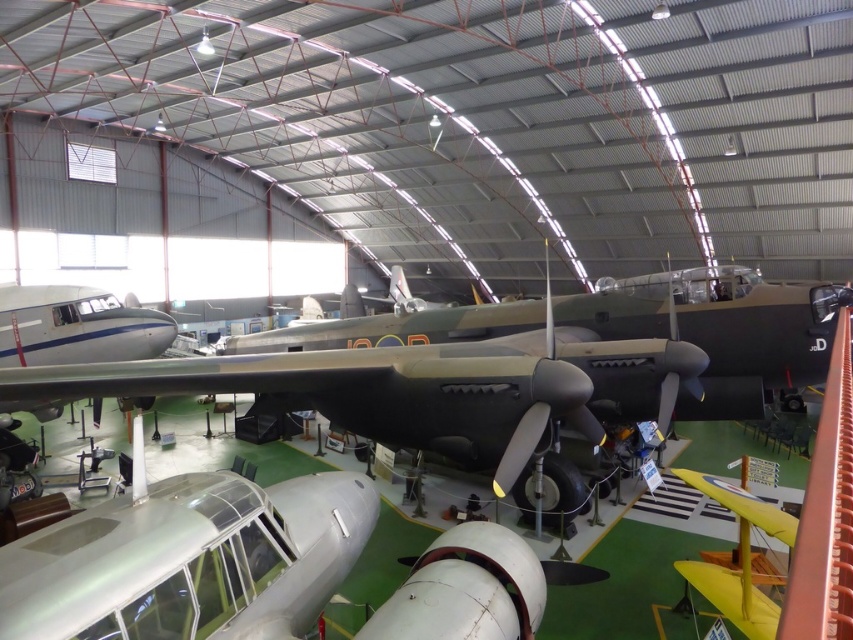
Is point (160, 387) positioned before point (722, 500)?

Yes, point (160, 387) is closer to viewer.

Which of these two, camouflage paint airplane at center or yellow matte airplane at lower right, stands shorter?

camouflage paint airplane at center is shorter.

Does point (666, 365) lie behind point (746, 513)?

Yes.

The width and height of the screenshot is (853, 640). What are the coordinates of `camouflage paint airplane at center` in the screenshot? It's located at (434, 387).

Does camouflage paint airplane at center come in front of metallic silver airplane at center?

No, it is not.

Is point (532, 433) closer to viewer compared to point (18, 545)?

No, (532, 433) is further to viewer.

The width and height of the screenshot is (853, 640). Identify the location of camouflage paint airplane at center. (434, 387).

The width and height of the screenshot is (853, 640). Find the location of `camouflage paint airplane at center`. camouflage paint airplane at center is located at coordinates (434, 387).

Consider the image. Does metallic silver airplane at center have a lesser width compared to yellow matte airplane at lower right?

Incorrect, metallic silver airplane at center's width is not less than yellow matte airplane at lower right's.

Is point (102, 632) in front of point (688, 563)?

That is True.

The width and height of the screenshot is (853, 640). Find the location of `metallic silver airplane at center`. metallic silver airplane at center is located at coordinates (190, 561).